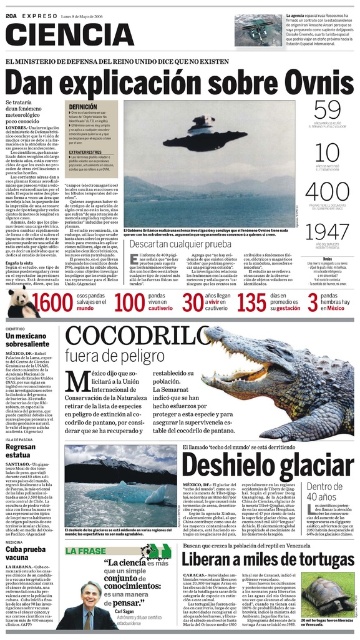
Question: Is shiny brown crocodile at center wider than matte gray crocodile at center?

Choices:
 (A) yes
 (B) no

Answer: (A)

Question: Does shiny brown crocodile at center have a larger size compared to matte gray crocodile at center?

Choices:
 (A) yes
 (B) no

Answer: (A)

Question: Which point is closer to the camera?

Choices:
 (A) matte gray crocodile at center
 (B) shiny brown crocodile at center

Answer: (A)

Question: Which object appears closest to the camera in this image?

Choices:
 (A) matte gray crocodile at center
 (B) shiny brown crocodile at center

Answer: (A)

Question: Can you confirm if shiny brown crocodile at center is positioned above matte gray crocodile at center?

Choices:
 (A) yes
 (B) no

Answer: (A)

Question: Which object is farther from the camera taking this photo?

Choices:
 (A) matte gray crocodile at center
 (B) shiny brown crocodile at center

Answer: (B)